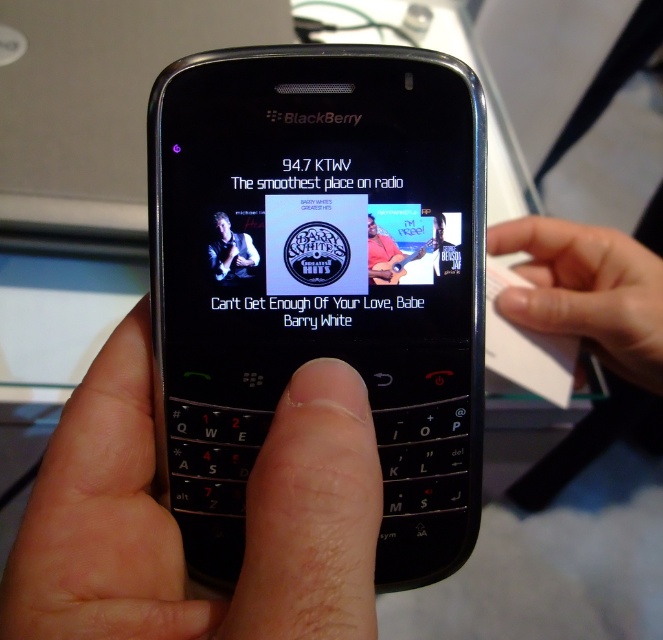
Between black glossy phone at center and skinny white finger at center, which one is positioned higher?

Positioned higher is black glossy phone at center.

Between black glossy phone at center and skinny white finger at center, which one appears on the left side from the viewer's perspective?

From the viewer's perspective, skinny white finger at center appears more on the left side.

Which is in front, point (286, 209) or point (168, 579)?

Point (168, 579) is in front.

This screenshot has height=640, width=663. What are the coordinates of `black glossy phone at center` in the screenshot? It's located at [x=320, y=282].

The height and width of the screenshot is (640, 663). Identify the location of black glossy phone at center. (320, 282).

Is black leather jacket at upper center wider than smooth skin hand at center?

Yes, black leather jacket at upper center is wider than smooth skin hand at center.

Does black leather jacket at upper center have a smaller size compared to smooth skin hand at center?

Incorrect, black leather jacket at upper center is not smaller in size than smooth skin hand at center.

Identify the location of black leather jacket at upper center. tap(229, 252).

Find the location of a particular element. black leather jacket at upper center is located at coordinates (229, 252).